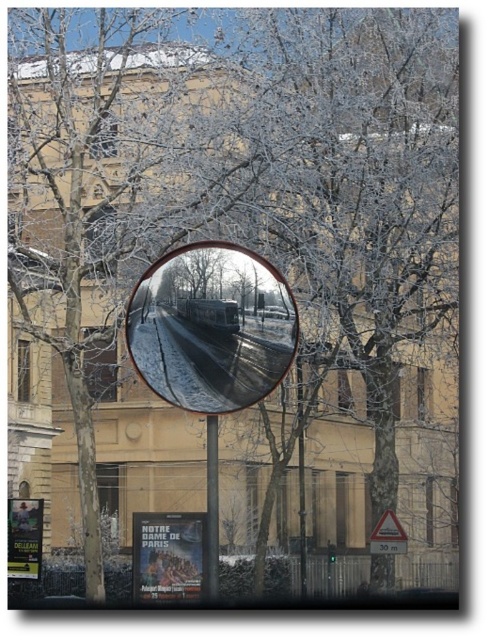
Question: Does metallic pole at center appear on the right side of yellow plastic triangle at lower right?

Choices:
 (A) no
 (B) yes

Answer: (A)

Question: Which object is positioned farthest from the yellow plastic triangle at lower right?

Choices:
 (A) metallic pole at center
 (B) clear glass mirror at center

Answer: (B)

Question: Can you confirm if clear glass mirror at center is positioned above metallic pole at center?

Choices:
 (A) no
 (B) yes

Answer: (B)

Question: Which object appears closest to the camera in this image?

Choices:
 (A) yellow plastic triangle at lower right
 (B) metallic pole at center

Answer: (B)

Question: Which point appears farthest from the camera in this image?

Choices:
 (A) coord(208,497)
 (B) coord(276,289)

Answer: (A)

Question: Does clear glass mirror at center have a larger size compared to yellow plastic triangle at lower right?

Choices:
 (A) no
 (B) yes

Answer: (B)